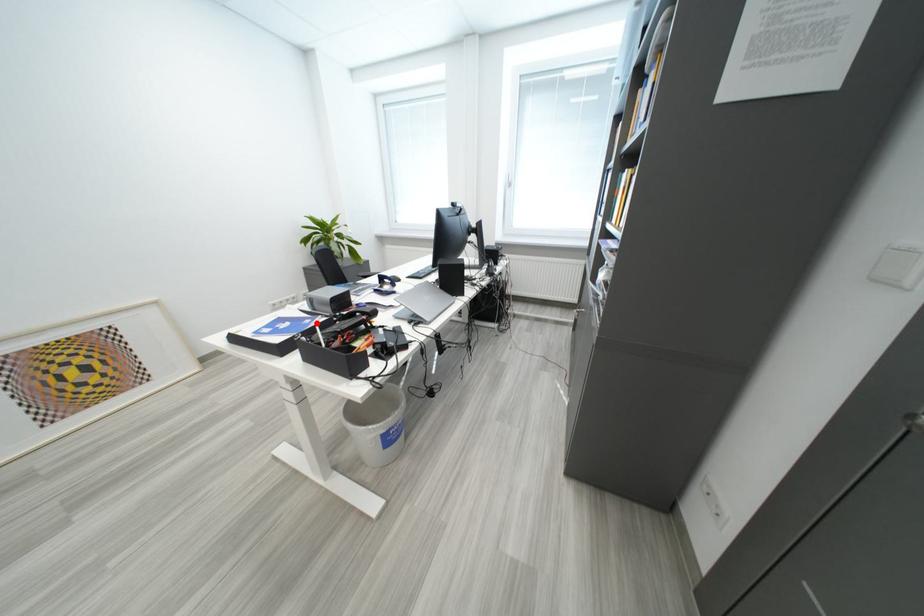
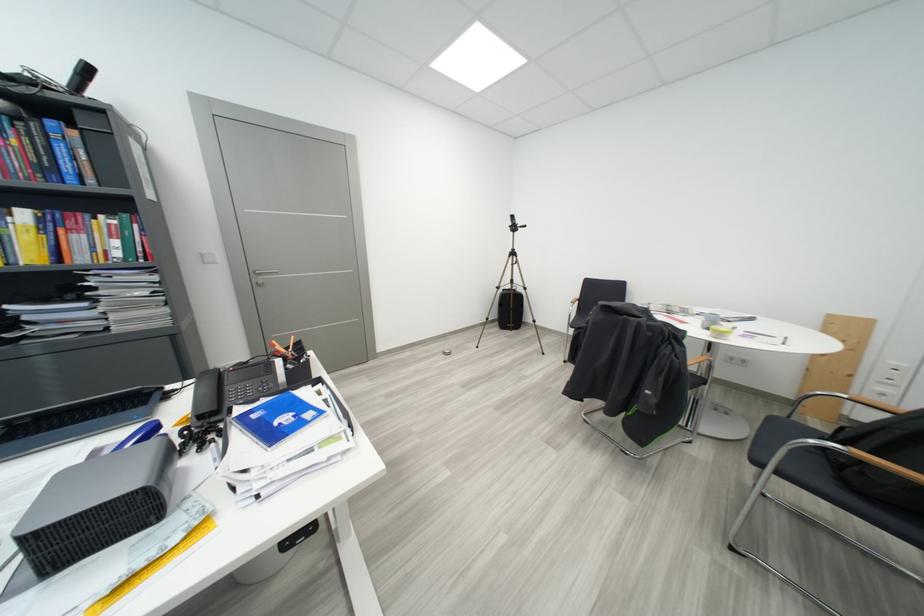
Find the pixel in the second image that matches the highlighted location in the first image.

(263, 419)